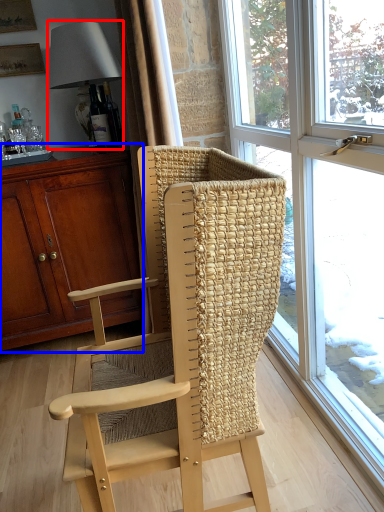
Question: Which of the following is the closest to the observer, lamp (highlighted by a red box) or cabinetry (highlighted by a blue box)?

Choices:
 (A) lamp
 (B) cabinetry

Answer: (B)